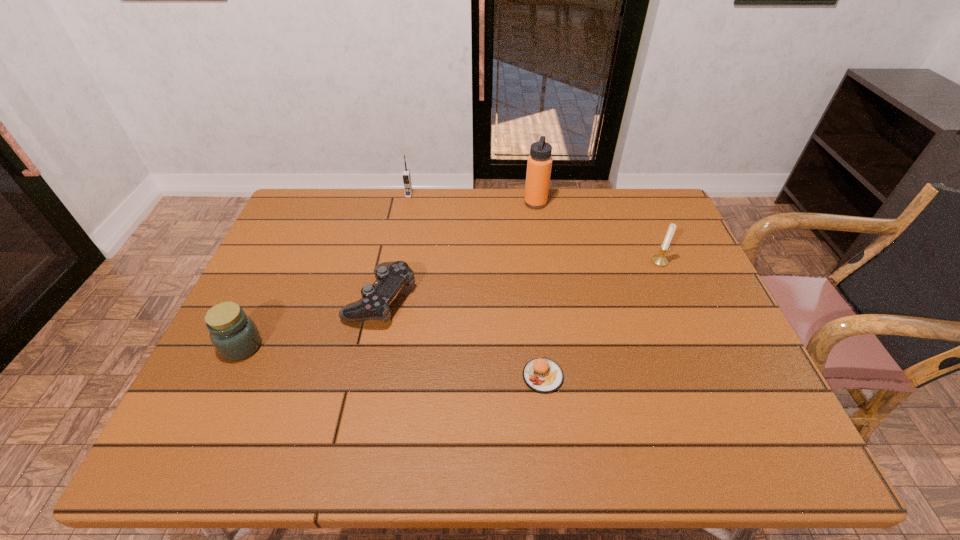
Locate an element on the screen. vacant space that is in between the leftmost object and the patty is located at coordinates (393, 361).

The width and height of the screenshot is (960, 540). Identify the location of vacant space that is in between the tallest object and the cellular telephone. (472, 199).

The image size is (960, 540). Find the location of `free space between the shortest object and the leftmost object`. free space between the shortest object and the leftmost object is located at coordinates (393, 361).

You are a GUI agent. You are given a task and a screenshot of the screen. Output one action in this format:
    pyautogui.click(x=<x>, y=<y>)
    Task: Click on the vacant region between the rightmost object and the second shortest object
    
    Given the screenshot: What is the action you would take?
    pyautogui.click(x=520, y=280)

At what (x,y) coordinates should I click in order to perform the action: click on object that ranks as the second closest to the thermos bottle. Please return your answer as a coordinate pair (x, y). The width and height of the screenshot is (960, 540). Looking at the image, I should click on (406, 176).

What are the coordinates of `object that is the second closest to the tallest object` in the screenshot? It's located at (406, 176).

At what (x,y) coordinates should I click in order to perform the action: click on vacant space that satisfies the following two spatial constraints: 1. on the front-facing side of the thermos bottle; 2. on the right side of the cellular telephone. Please return your answer as a coordinate pair (x, y). Looking at the image, I should click on (407, 203).

This screenshot has height=540, width=960. I want to click on blank space that satisfies the following two spatial constraints: 1. on the front-facing side of the cellular telephone; 2. on the right side of the shortest object, so (x=373, y=376).